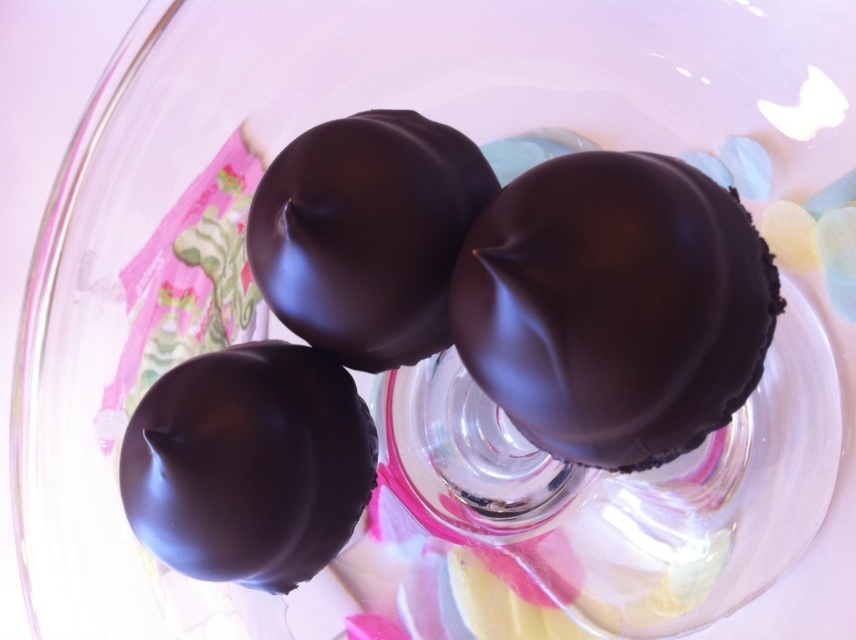
Question: Is shiny dark chocolate at center smaller than matte chocolate truffle at center?

Choices:
 (A) yes
 (B) no

Answer: (B)

Question: Does matte dark chocolate at lower left appear on the left side of matte chocolate truffle at center?

Choices:
 (A) no
 (B) yes

Answer: (B)

Question: Which point is farther to the camera?

Choices:
 (A) (421, 352)
 (B) (770, 305)

Answer: (A)

Question: Which object is the farthest from the matte chocolate truffle at center?

Choices:
 (A) shiny dark chocolate at center
 (B) matte dark chocolate at lower left

Answer: (A)

Question: Which is farther from the matte dark chocolate at lower left?

Choices:
 (A) shiny dark chocolate at center
 (B) matte chocolate truffle at center

Answer: (A)

Question: From the image, what is the correct spatial relationship of matte dark chocolate at lower left in relation to matte chocolate truffle at center?

Choices:
 (A) below
 (B) above

Answer: (A)